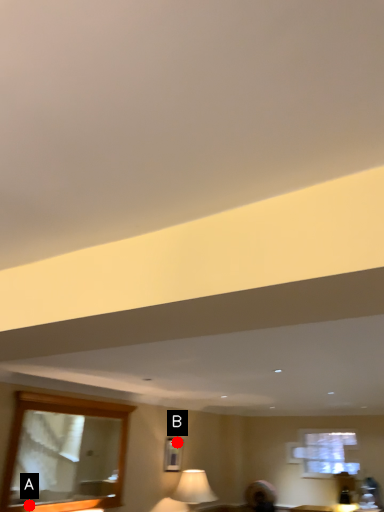
Question: Two points are circled on the image, labeled by A and B beside each circle. Which point appears farthest from the camera in this image?

Choices:
 (A) A is further
 (B) B is further

Answer: (B)